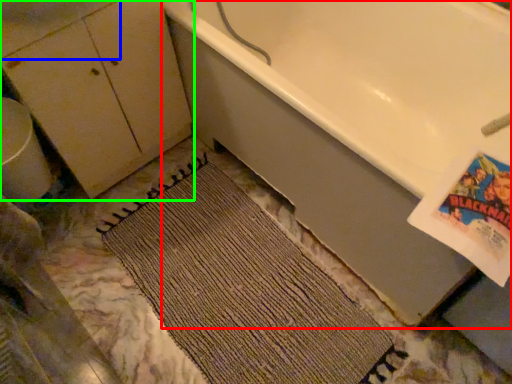
Question: Considering the real-world distances, which object is farthest from bathtub (highlighted by a red box)? sink (highlighted by a blue box) or dresser (highlighted by a green box)?

Choices:
 (A) sink
 (B) dresser

Answer: (A)